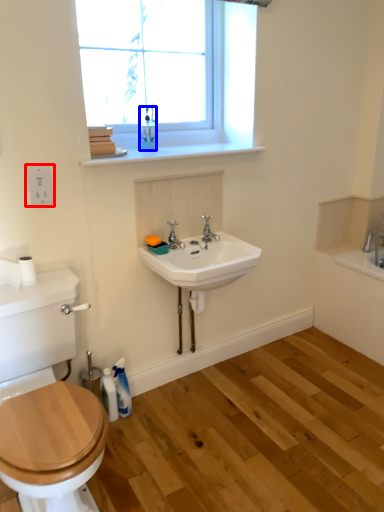
Question: Which of the following is the farthest to the observer, electric outlet (highlighted by a red box) or toiletry (highlighted by a blue box)?

Choices:
 (A) electric outlet
 (B) toiletry

Answer: (B)